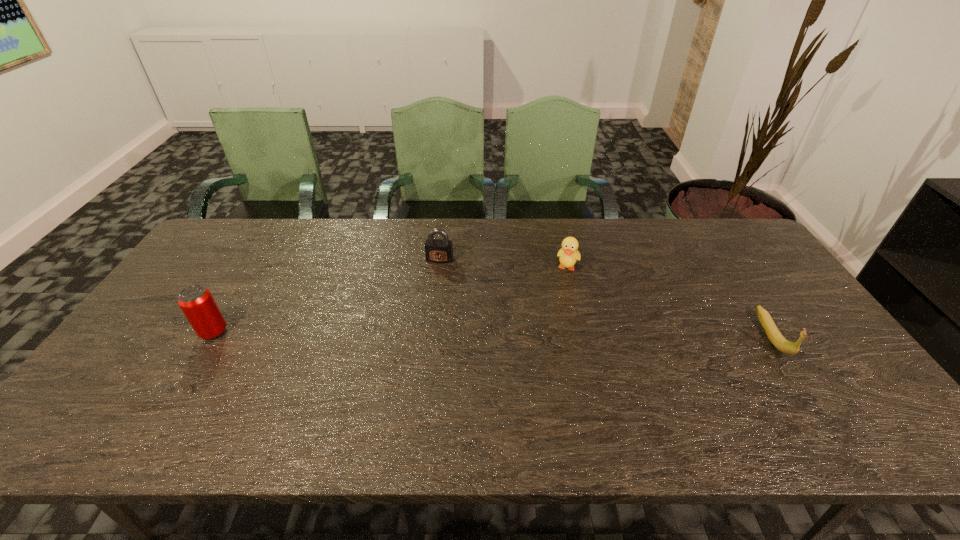
Identify the location of blank region between the tallest object and the second object from left to right. The image size is (960, 540). [x=326, y=296].

Identify the location of vacant space in between the leftmost object and the third object from right to left. (326, 296).

This screenshot has width=960, height=540. Identify the location of free space that is in between the can and the third object from right to left. coord(326,296).

I want to click on object that ranks as the closest to the duckling, so click(x=436, y=250).

Where is `the third closest object to the duckling`? The width and height of the screenshot is (960, 540). the third closest object to the duckling is located at coordinates (196, 302).

The image size is (960, 540). What are the coordinates of `free location that satisfies the following two spatial constraints: 1. on the back side of the duckling; 2. on the left side of the tallest object` in the screenshot? It's located at (252, 268).

Where is `free space that satisfies the following two spatial constraints: 1. on the back side of the third object from right to left; 2. on the right side of the can`? Image resolution: width=960 pixels, height=540 pixels. free space that satisfies the following two spatial constraints: 1. on the back side of the third object from right to left; 2. on the right side of the can is located at coordinates pyautogui.click(x=257, y=260).